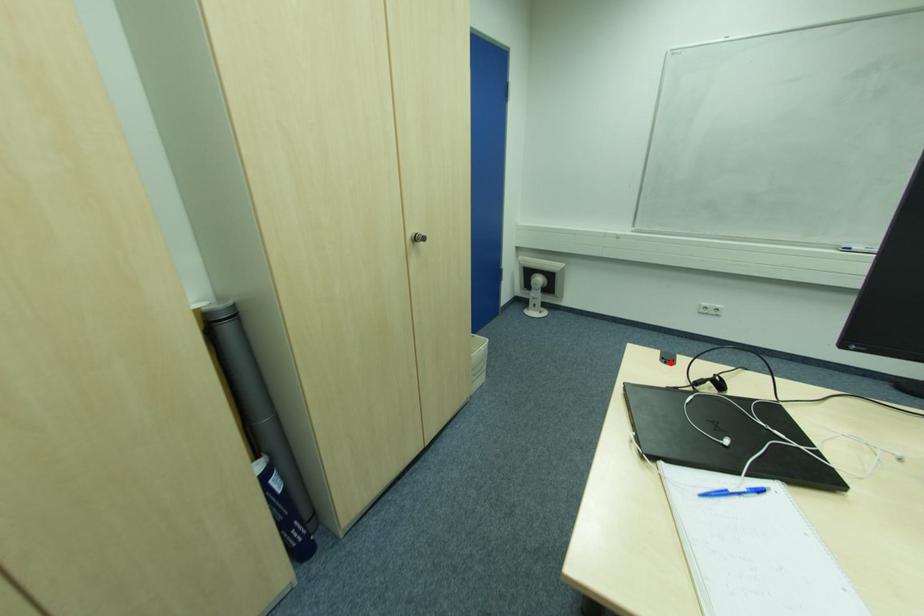
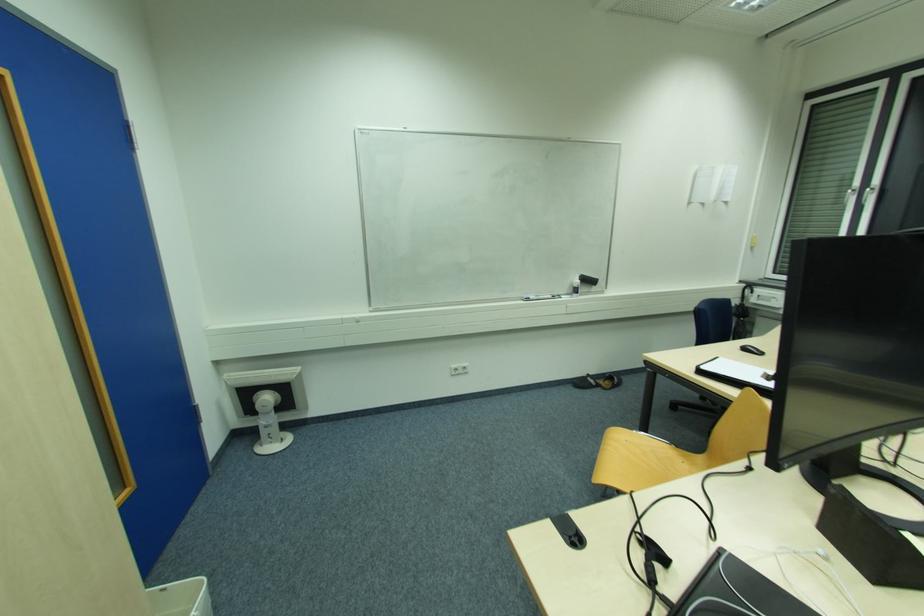
In the second image, find the point that corresponds to the highlighted location in the first image.

(578, 541)